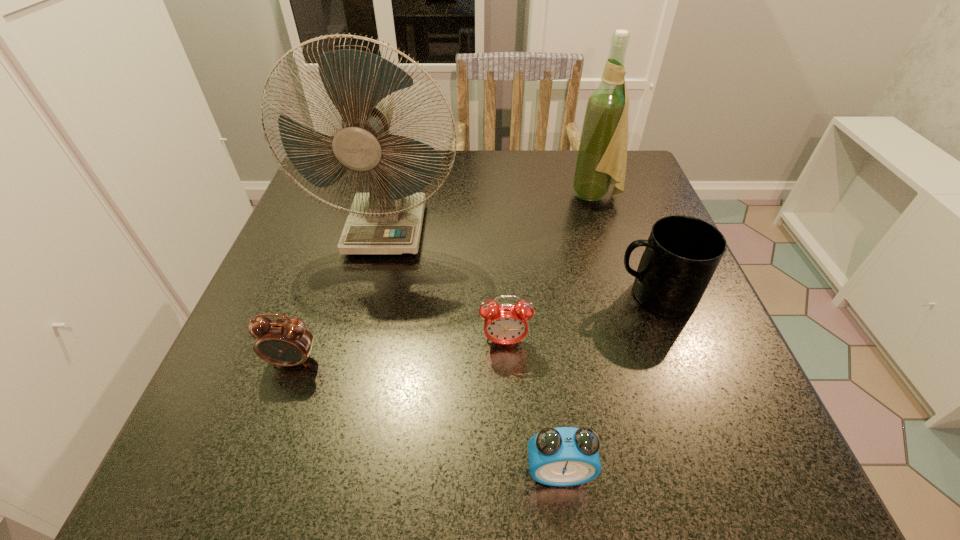
Locate an element on the screen. Image resolution: width=960 pixels, height=540 pixels. fan is located at coordinates (388, 220).

The width and height of the screenshot is (960, 540). Identify the location of wine bottle. (602, 154).

Find the location of a particular element. The width and height of the screenshot is (960, 540). the third farthest object is located at coordinates (682, 253).

This screenshot has height=540, width=960. Identify the location of mug. (682, 253).

Identify the location of the second nearest object. Image resolution: width=960 pixels, height=540 pixels. (287, 342).

In order to click on the second nearest alarm clock in this screenshot , I will do `click(287, 342)`.

The width and height of the screenshot is (960, 540). In order to click on the farthest alarm clock in this screenshot , I will do `click(506, 323)`.

Where is `the nearest object`? Image resolution: width=960 pixels, height=540 pixels. the nearest object is located at coordinates (563, 456).

Locate an element on the screen. The image size is (960, 540). vacant space located on the front-facing side of the fan is located at coordinates (343, 413).

You are a GUI agent. You are given a task and a screenshot of the screen. Output one action in this format:
    pyautogui.click(x=<x>, y=<y>)
    Task: Click on the free spot located 0.350m on the front-facing side of the wine bottle
    
    Given the screenshot: What is the action you would take?
    pyautogui.click(x=421, y=196)